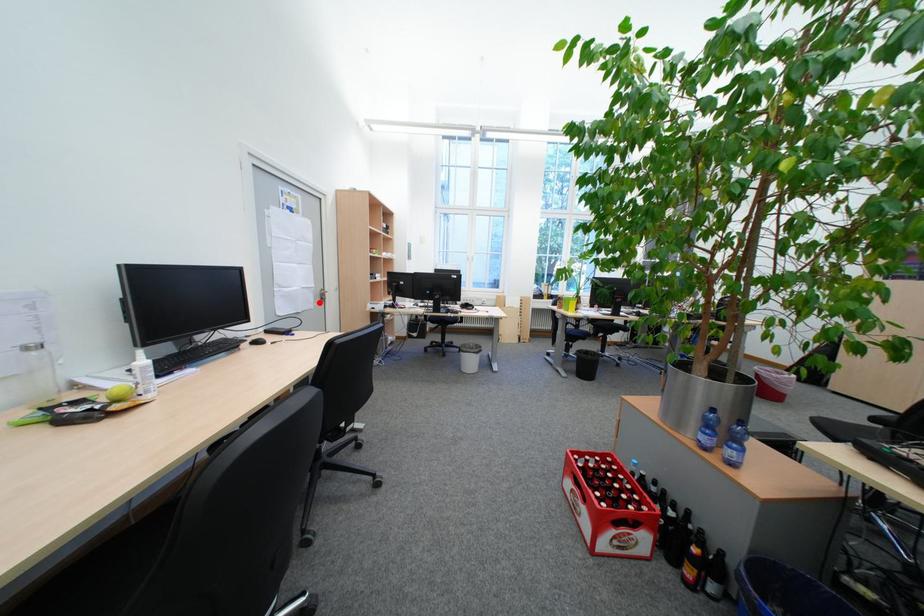
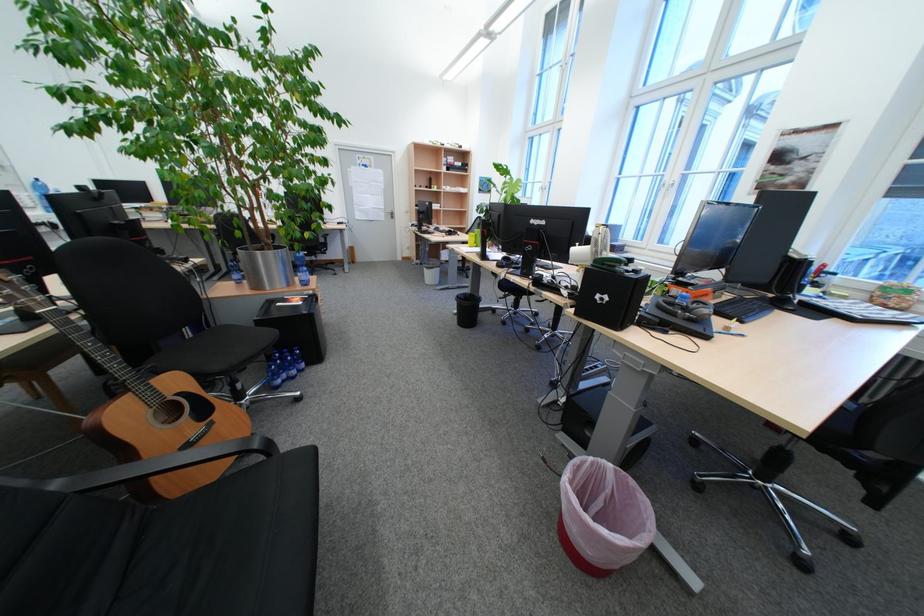
In the second image, find the point that corresponds to the highlighted location in the first image.

(394, 217)